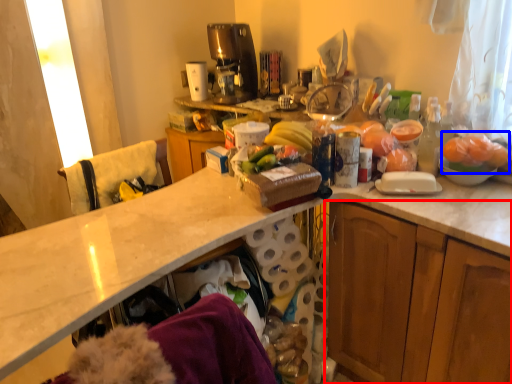
Question: Which of the following is the farthest to the observer, cabinetry (highlighted by a red box) or fruit (highlighted by a blue box)?

Choices:
 (A) cabinetry
 (B) fruit

Answer: (B)